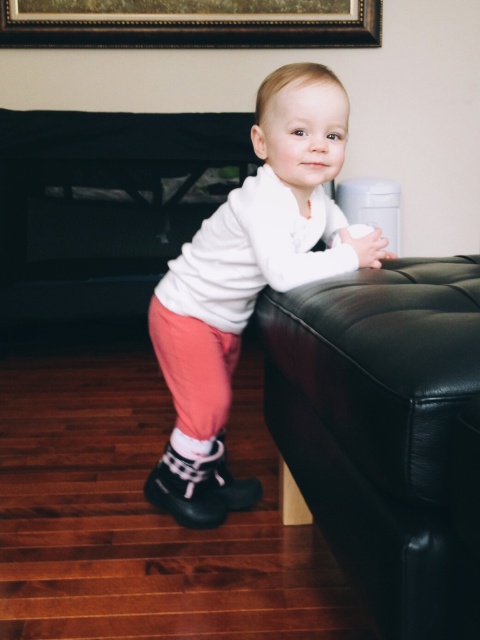
Between black leather ottoman at right and white soft sweater at center, which one is positioned higher?

white soft sweater at center is higher up.

From the picture: Which is below, black leather ottoman at right or white soft sweater at center?

black leather ottoman at right is below.

This screenshot has height=640, width=480. Identify the location of black leather ottoman at right. (385, 432).

Is black leather ottoman at right shorter than gold/black wood picture frame at upper center?

In fact, black leather ottoman at right may be taller than gold/black wood picture frame at upper center.

Does point (276, 330) come in front of point (373, 38)?

Yes, point (276, 330) is closer to viewer.

Measure the distance between black leather ottoman at right and camera.

black leather ottoman at right is 26.79 inches away from camera.

Where is `black leather ottoman at right`? The width and height of the screenshot is (480, 640). black leather ottoman at right is located at coordinates (385, 432).

Is white soft sweater at center further to camera compared to gold/black wood picture frame at upper center?

No.

Is white soft sweater at center above gold/black wood picture frame at upper center?

Actually, white soft sweater at center is below gold/black wood picture frame at upper center.

Between point (203, 241) and point (14, 35), which one is positioned in front?

Point (203, 241)

You are a GUI agent. You are given a task and a screenshot of the screen. Output one action in this format:
    pyautogui.click(x=<x>, y=<y>)
    Task: Click on the white soft sweater at center
    
    Given the screenshot: What is the action you would take?
    pyautogui.click(x=248, y=282)